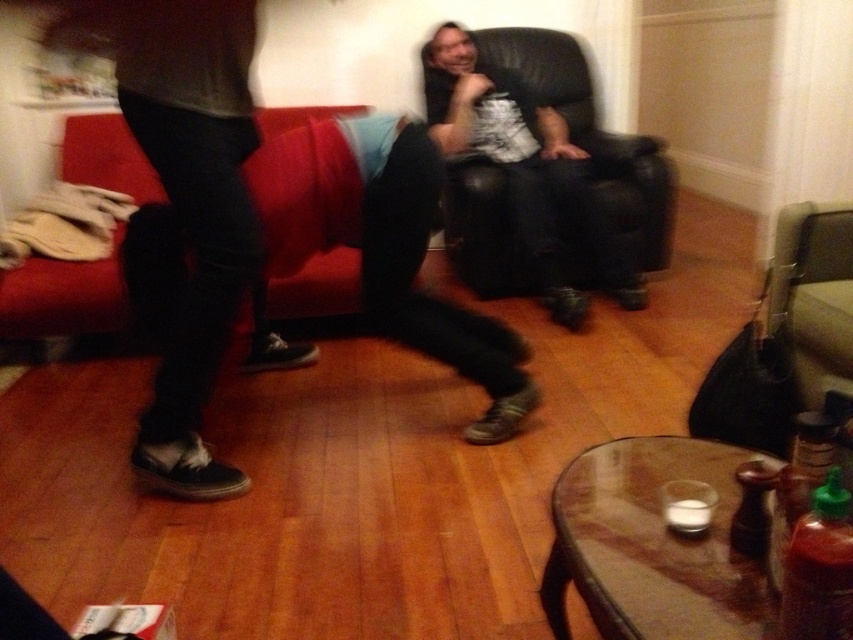
Can you confirm if matte black leather chair at center is wider than red fabric couch at left?

Correct, the width of matte black leather chair at center exceeds that of red fabric couch at left.

Does matte black leather chair at center appear on the left side of red fabric couch at left?

No, matte black leather chair at center is not to the left of red fabric couch at left.

Which is behind, point (640, 289) or point (108, 140)?

Point (640, 289)

The height and width of the screenshot is (640, 853). In order to click on matte black leather chair at center in this screenshot , I will do `click(524, 168)`.